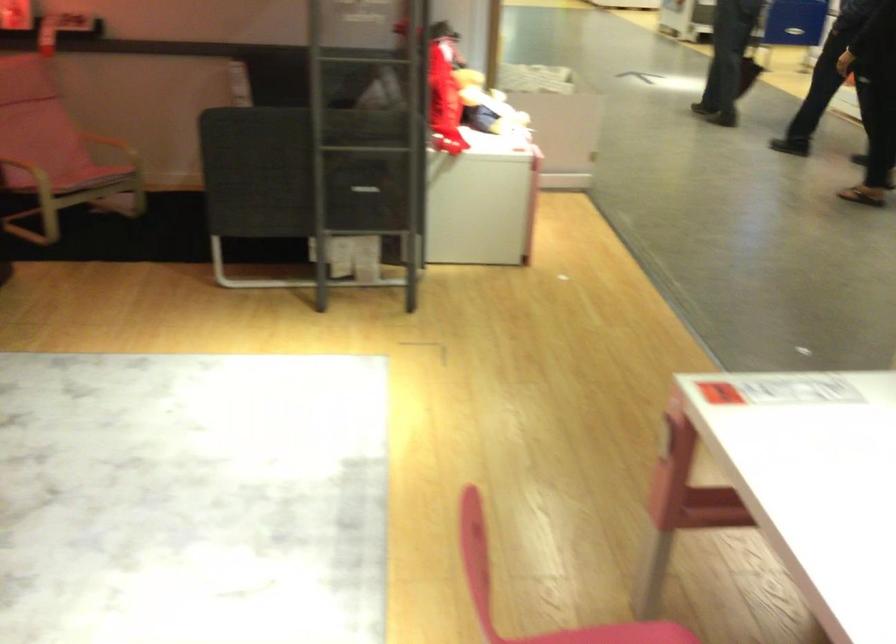
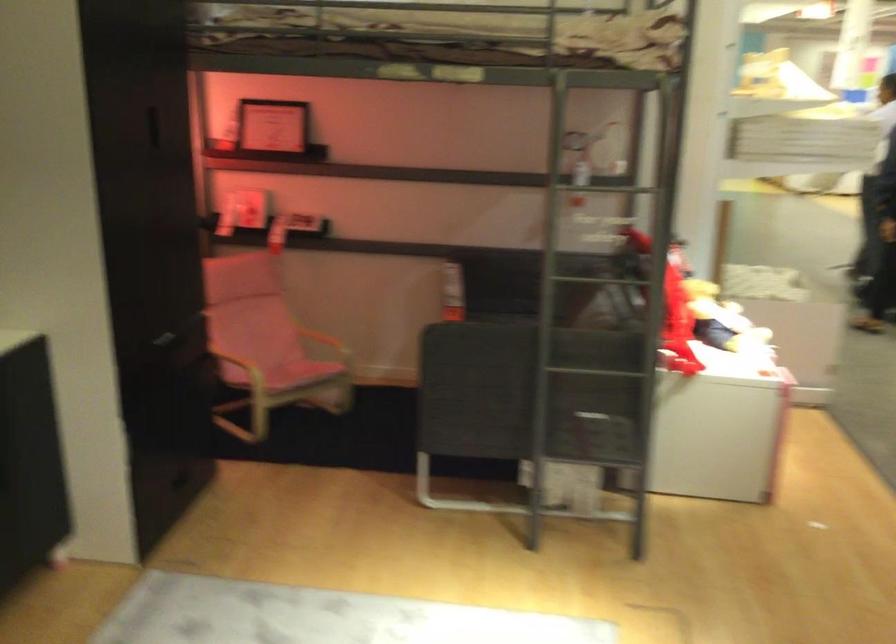
Where in the second image is the point corresponding to (x=448, y=115) from the first image?

(677, 325)